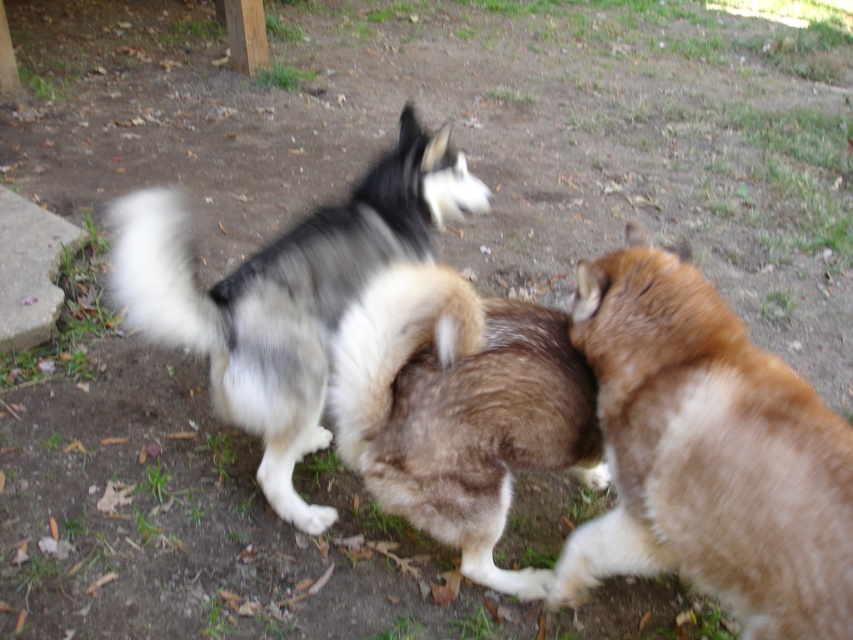
Locate an element on the screen. fuzzy brown dog at center is located at coordinates (459, 408).

Identify the location of fuzzy brown dog at center. (459, 408).

Is brown fluffy dog at right bigger than fuzzy brown dog at center?

No, brown fluffy dog at right is not bigger than fuzzy brown dog at center.

Who is positioned more to the left, brown fluffy dog at right or fuzzy brown dog at center?

fuzzy brown dog at center

Measure the distance between brown fluffy dog at right and camera.

brown fluffy dog at right is 4.77 feet away from camera.

This screenshot has width=853, height=640. Find the location of `brown fluffy dog at right`. brown fluffy dog at right is located at coordinates (708, 454).

Between brown fluffy dog at right and black and white fur dog at center, which one is positioned higher?

black and white fur dog at center is above.

Who is more forward, (554, 588) or (282, 500)?

Point (554, 588) is more forward.

Identify the location of brown fluffy dog at right. (708, 454).